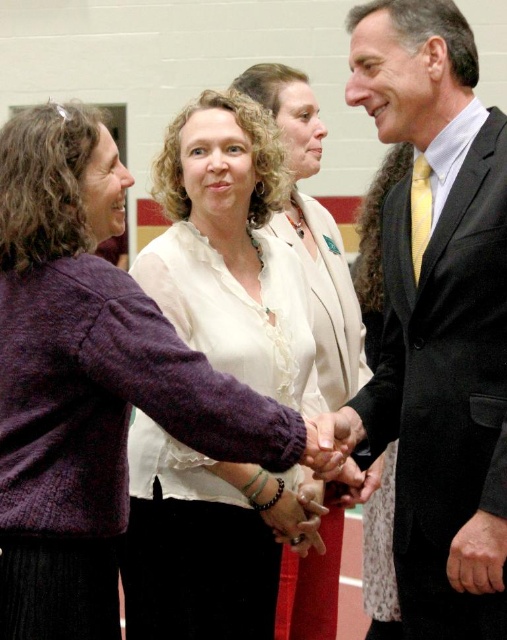
From the picture: Is knitted purple sweater at left below matte black bracelet at center?

Correct, knitted purple sweater at left is located below matte black bracelet at center.

From the picture: Does knitted purple sweater at left have a larger size compared to matte black bracelet at center?

No, knitted purple sweater at left is not bigger than matte black bracelet at center.

Is point (184, 362) behind point (280, 502)?

That is False.

This screenshot has height=640, width=507. Identify the location of knitted purple sweater at left. (89, 380).

How far apart are matte black bracelet at center and smooth leather hand at center?

They are 3.74 feet apart.

Which is more to the right, matte black bracelet at center or smooth leather hand at center?

Positioned to the right is smooth leather hand at center.

Describe the element at coordinates (298, 516) in the screenshot. The image size is (507, 640). I see `matte black bracelet at center` at that location.

Where is `matte black bracelet at center`? matte black bracelet at center is located at coordinates (298, 516).

Does knitted purple sweater at left have a greater width compared to matte purple sweater at center?

No, knitted purple sweater at left is not wider than matte purple sweater at center.

Who is positioned more to the right, knitted purple sweater at left or matte purple sweater at center?

matte purple sweater at center

At what (x,y) coordinates should I click in order to perform the action: click on knitted purple sweater at left. Please return your answer as a coordinate pair (x, y). The height and width of the screenshot is (640, 507). Looking at the image, I should click on (89, 380).